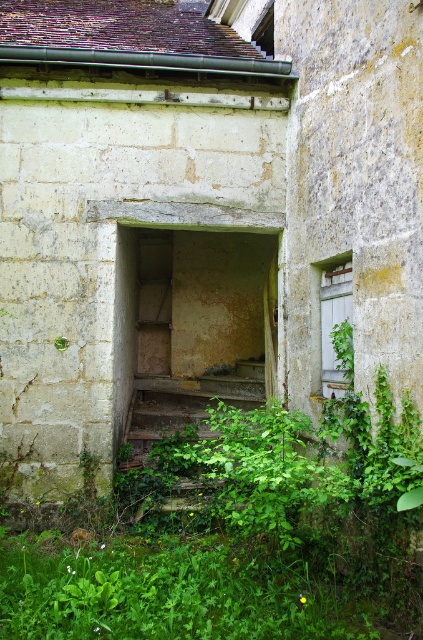
Question: Is green leafy plant at lower center above wooden rustic stairs at center?

Choices:
 (A) yes
 (B) no

Answer: (B)

Question: Can you confirm if green leafy plant at lower center is smaller than wooden rustic stairs at center?

Choices:
 (A) no
 (B) yes

Answer: (A)

Question: Among these points, which one is farthest from the camera?

Choices:
 (A) (255, 554)
 (B) (255, 385)

Answer: (B)

Question: Does green leafy plant at lower center appear on the left side of wooden rustic stairs at center?

Choices:
 (A) no
 (B) yes

Answer: (A)